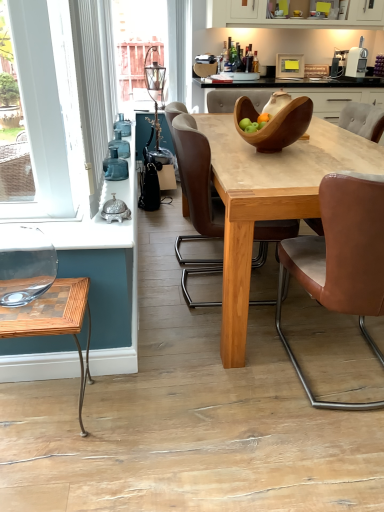
This screenshot has height=512, width=384. What are the coordinates of `blank area to the left of brown leather chair at center, which appears as the 2th chair when viewed from the left` in the screenshot? It's located at (233, 401).